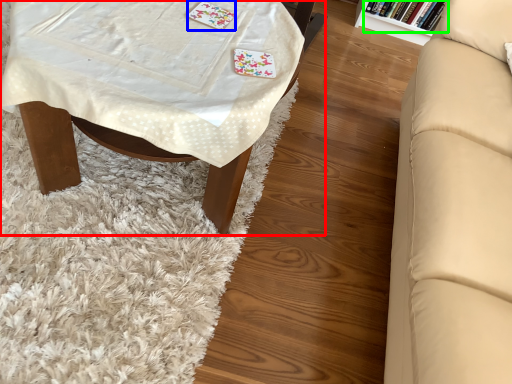
Question: Based on their relative distances, which object is farther from table (highlighted by a red box)? Choose from card game (highlighted by a blue box) and book (highlighted by a green box).

Choices:
 (A) card game
 (B) book

Answer: (B)